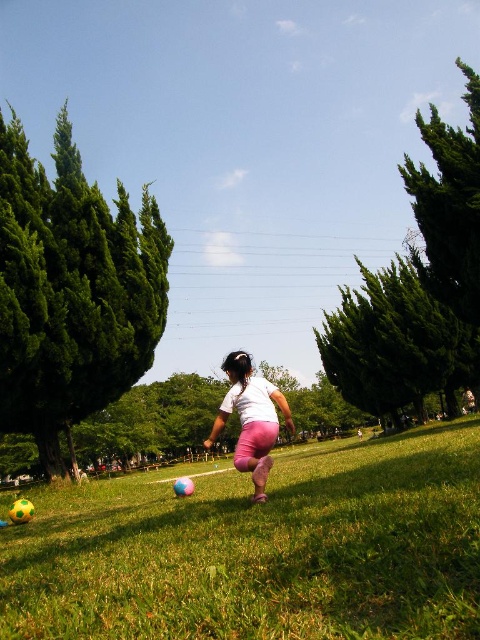
Question: Is green grassy field at center positioned behind white matte shirt at center?

Choices:
 (A) no
 (B) yes

Answer: (A)

Question: Among these objects, which one is nearest to the camera?

Choices:
 (A) green grassy field at center
 (B) white matte shirt at center

Answer: (A)

Question: Does green grassy field at center appear on the left side of white matte shirt at center?

Choices:
 (A) no
 (B) yes

Answer: (A)

Question: In this image, where is green grassy field at center located relative to white matte shirt at center?

Choices:
 (A) right
 (B) left

Answer: (A)